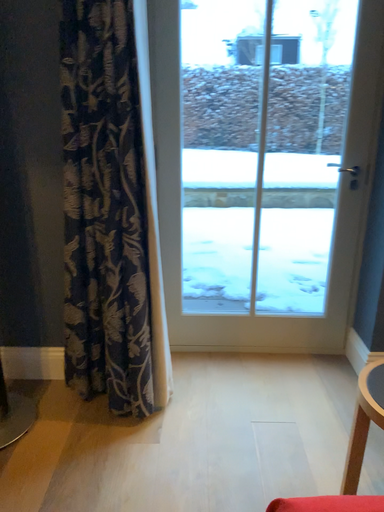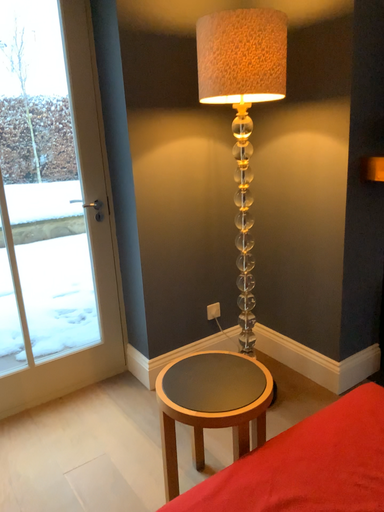
Question: How did the camera likely rotate when shooting the video?

Choices:
 (A) rotated left
 (B) rotated right

Answer: (B)